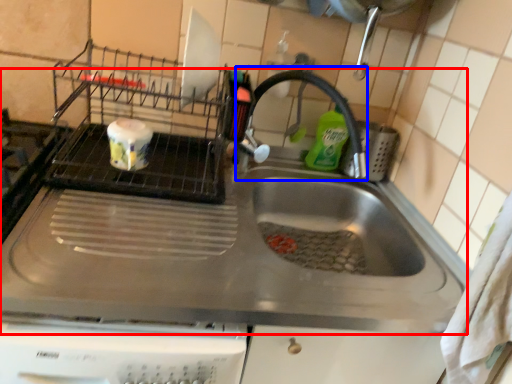
Question: Which object is further to the camera taking this photo, sink (highlighted by a red box) or faucet (highlighted by a blue box)?

Choices:
 (A) sink
 (B) faucet

Answer: (B)